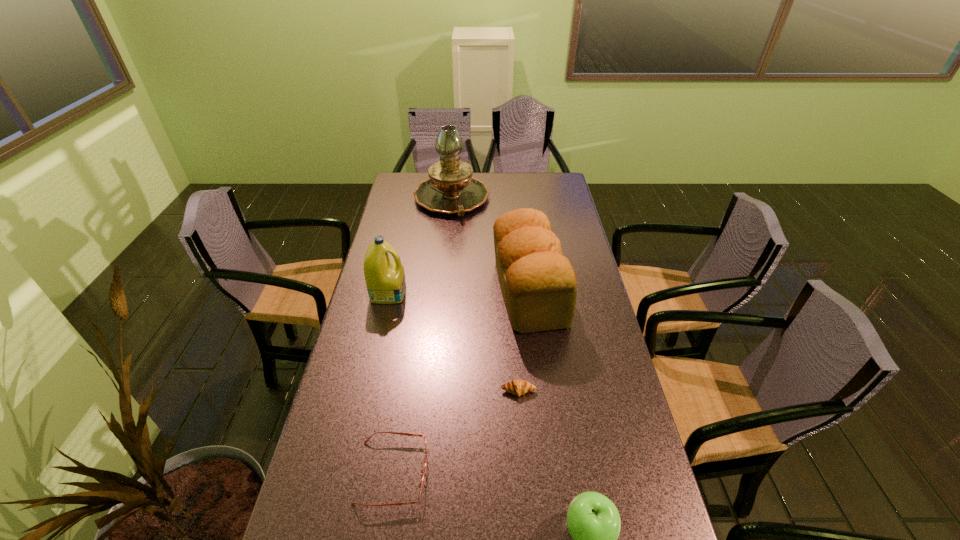
Identify which object is the nearest to the detergent. Please provide its 2D coordinates. Your answer should be formatted as a tuple, i.e. [(x, y)], where the tuple contains the x and y coordinates of a point satisfying the conditions above.

[(539, 286)]

Locate which object ranks fifth in proximity to the fifth tallest object. Please provide its 2D coordinates. Your answer should be formatted as a tuple, i.e. [(x, y)], where the tuple contains the x and y coordinates of a point satisfying the conditions above.

[(450, 189)]

Locate an element on the screen. free space that satisfies the following two spatial constraints: 1. on the front-facing side of the third nearest object; 2. on the lenses of the fifth tallest object is located at coordinates (524, 472).

Locate an element on the screen. free spot that satisfies the following two spatial constraints: 1. on the front side of the bread; 2. on the lenses of the spectacles is located at coordinates (551, 472).